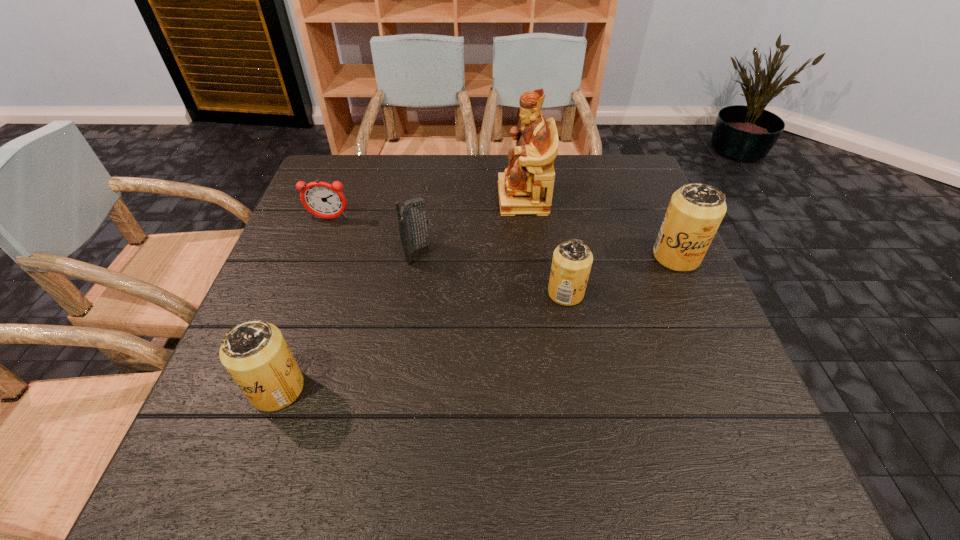
Identify the location of alarm clock situated at the left edge. (321, 199).

Where is `object situated at the right edge`? The height and width of the screenshot is (540, 960). object situated at the right edge is located at coordinates (695, 211).

Locate an element on the screen. This screenshot has height=540, width=960. object present at the near left corner is located at coordinates (255, 353).

Identify the location of vacant space at the far edge. (425, 169).

This screenshot has width=960, height=540. Identify the location of vacant space at the near edge. (469, 423).

In the image, there is a desktop. What are the coordinates of `vacant space at the left edge` in the screenshot? It's located at (284, 245).

I want to click on blank space at the right edge, so click(697, 376).

You are a GUI agent. You are given a task and a screenshot of the screen. Output one action in this format:
    pyautogui.click(x=<x>, y=<y>)
    Task: Click on the vacant space at the far left corner of the desktop
    Image resolution: width=960 pixels, height=540 pixels.
    Given the screenshot: What is the action you would take?
    pyautogui.click(x=358, y=174)

Where is `free space at the far right corner`? Image resolution: width=960 pixels, height=540 pixels. free space at the far right corner is located at coordinates (638, 187).

Where is `free area in between the rightmost object and the alarm clock`? The width and height of the screenshot is (960, 540). free area in between the rightmost object and the alarm clock is located at coordinates tap(503, 238).